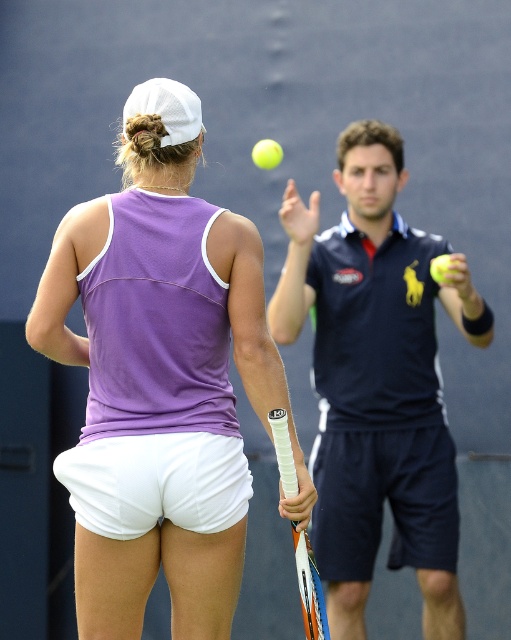
Question: Among these points, which one is nearest to the camera?

Choices:
 (A) (268, 150)
 (B) (111, 276)

Answer: (B)

Question: Which is farther from the yellow matte tennis ball at center?

Choices:
 (A) purple fabric tennis outfit at center
 (B) white textured grip at lower center
 (C) dark blue polo shirt at center

Answer: (B)

Question: Does dark blue polo shirt at center appear under yellow matte tennis ball at center?

Choices:
 (A) yes
 (B) no

Answer: (A)

Question: Is white textured grip at lower center behind yellow matte tennis ball at center?

Choices:
 (A) yes
 (B) no

Answer: (B)

Question: Which object appears farthest from the camera in this image?

Choices:
 (A) purple fabric tennis outfit at center
 (B) yellow matte tennis ball at center
 (C) white textured grip at lower center

Answer: (B)

Question: Can you confirm if purple fabric tennis outfit at center is positioned above dark blue polo shirt at center?

Choices:
 (A) yes
 (B) no

Answer: (A)